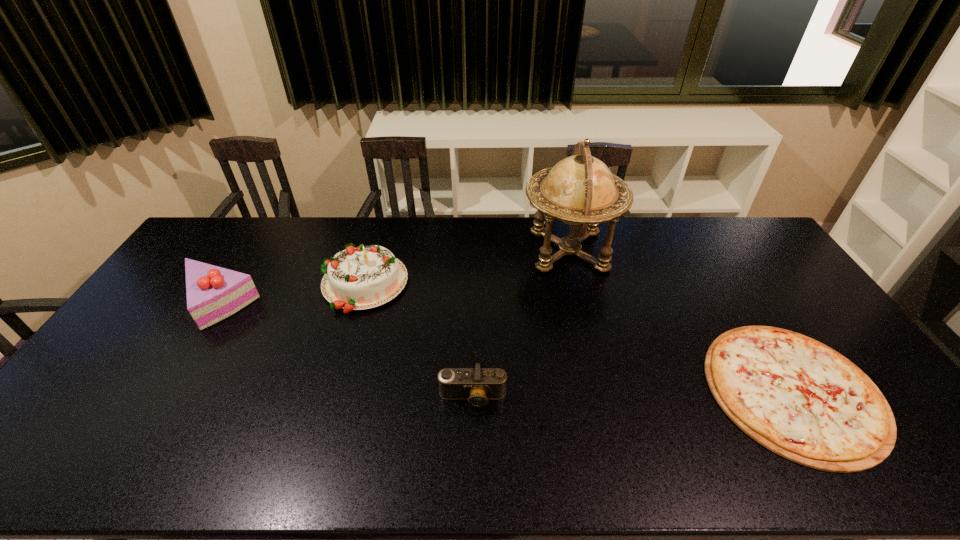
Identify the location of vacant space located 0.230m on the front-facing side of the tallest object. (458, 251).

Locate an element on the screen. The width and height of the screenshot is (960, 540). vacant space situated on the front-facing side of the tallest object is located at coordinates pyautogui.click(x=468, y=251).

At what (x,y) coordinates should I click in order to perform the action: click on free region located 0.260m on the front-facing side of the tallest object. Please return your answer as a coordinate pair (x, y). The width and height of the screenshot is (960, 540). Looking at the image, I should click on (449, 251).

Locate an element on the screen. vacant position located 0.160m on the left of the taller cake is located at coordinates (269, 284).

You are a GUI agent. You are given a task and a screenshot of the screen. Output one action in this format:
    pyautogui.click(x=<x>, y=<y>)
    Task: Click on the vacant space located on the back of the third shortest object
    This screenshot has height=540, width=960.
    Given the screenshot: What is the action you would take?
    pyautogui.click(x=243, y=264)

Locate an element on the screen. The image size is (960, 540). free space located on the lens of the fourth tallest object is located at coordinates (471, 462).

You are a GUI agent. You are given a task and a screenshot of the screen. Output one action in this format:
    pyautogui.click(x=<x>, y=<y>)
    Task: Click on the free spot located on the back of the rightmost object
    
    Given the screenshot: What is the action you would take?
    pyautogui.click(x=706, y=247)

At what (x,y) coordinates should I click in order to perform the action: click on globe located in the far edge section of the desktop. Please return your answer as a coordinate pair (x, y). The width and height of the screenshot is (960, 540). Looking at the image, I should click on (580, 190).

The image size is (960, 540). Identify the location of cake that is at the far edge. (359, 278).

Where is `object that is positioned at the near edge`? This screenshot has height=540, width=960. object that is positioned at the near edge is located at coordinates (797, 397).